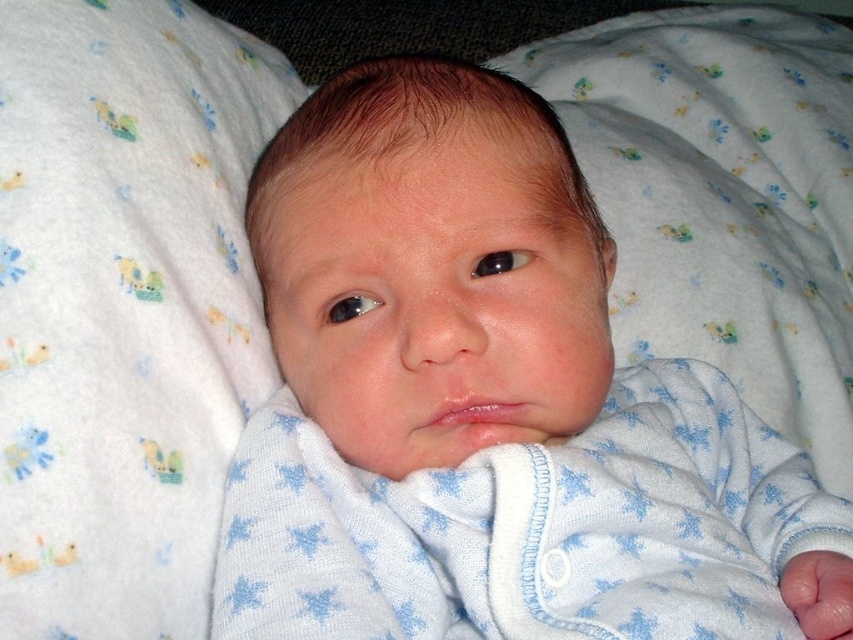
Question: Considering the real-world distances, which object is farthest from the white soft fabric baby at center?

Choices:
 (A) white soft fabric at center
 (B) white knit fabric at center

Answer: (B)

Question: Which point appears farthest from the camera in this image?

Choices:
 (A) (91, 332)
 (B) (770, 122)

Answer: (B)

Question: Which is farther from the white soft fabric at center?

Choices:
 (A) white knit fabric at center
 (B) white soft fabric baby at center

Answer: (A)

Question: Does white soft fabric baby at center appear on the left side of white knit fabric at center?

Choices:
 (A) yes
 (B) no

Answer: (A)

Question: Does white soft fabric baby at center appear on the right side of white soft fabric at center?

Choices:
 (A) no
 (B) yes

Answer: (B)

Question: Is white soft fabric at center smaller than white knit fabric at center?

Choices:
 (A) yes
 (B) no

Answer: (A)